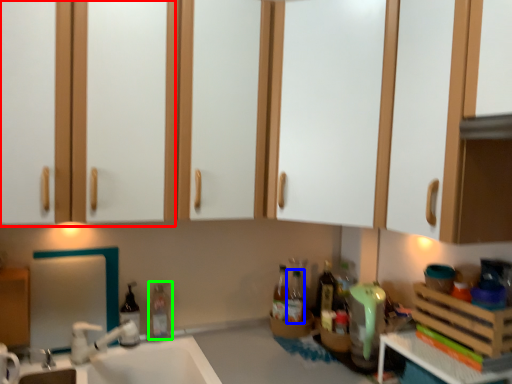
Question: Which is farther away from cabinetry (highlighted by a red box)? bottle (highlighted by a blue box) or bottle (highlighted by a green box)?

Choices:
 (A) bottle
 (B) bottle

Answer: (A)